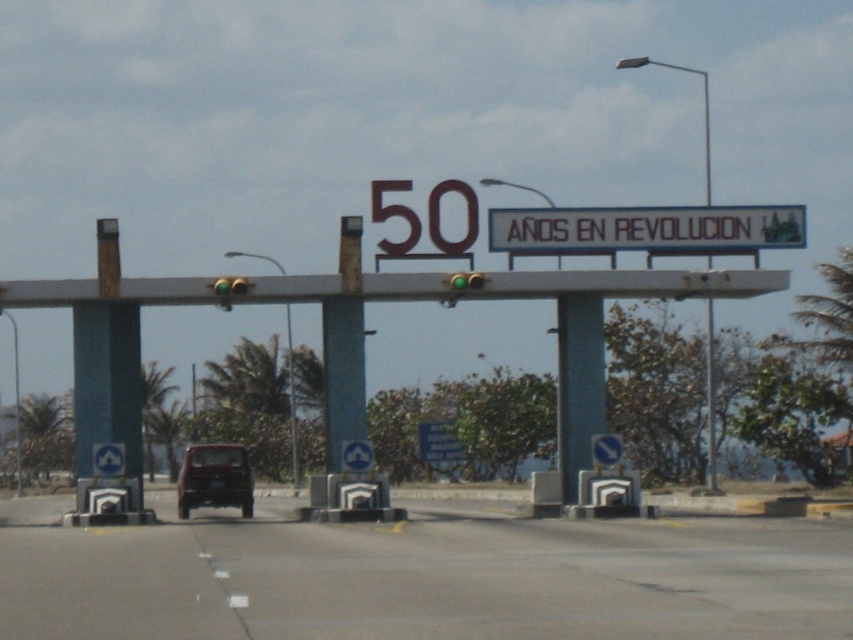
You are a delivery driver approaching the toll booth and need to know if your truck with a height limit of 4 meters can pass under the metallic gray overpass at center and the green glossy signpost at left. Which structure requires more caution regarding the truck height limit?

The green glossy signpost at left is taller than the metallic gray overpass at center, so the truck must be cautious of the green glossy signpost at left to avoid collision.

You are a photographer trying to capture the shiny red car at center in your shot. The blue concrete pillar at center is blocking part of the car. Can you move the pillar to get a better angle?

The blue concrete pillar at center has a smaller size compared to shiny red car at center. Since the pillar is smaller, you can move around it to get a better angle without needing to physically move the pillar itself.